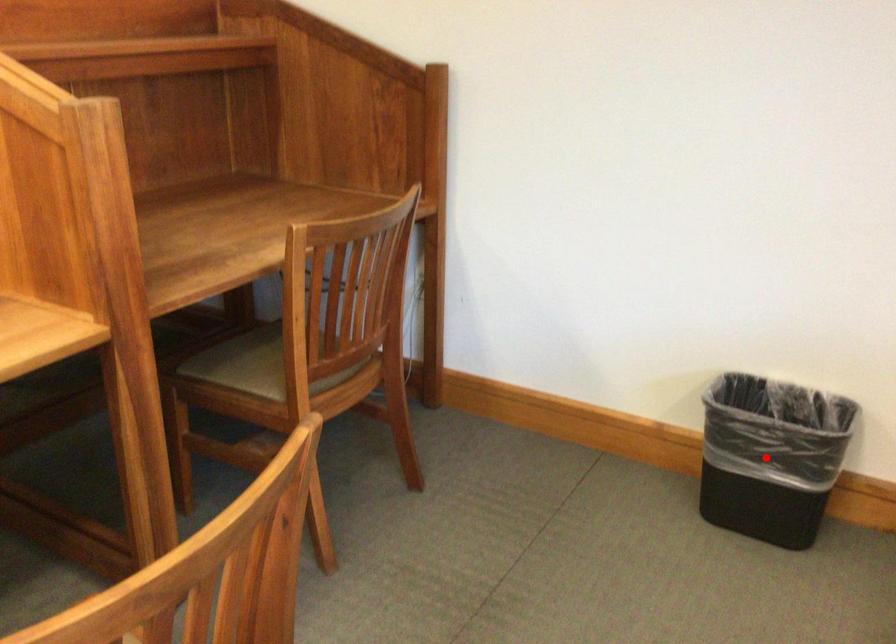
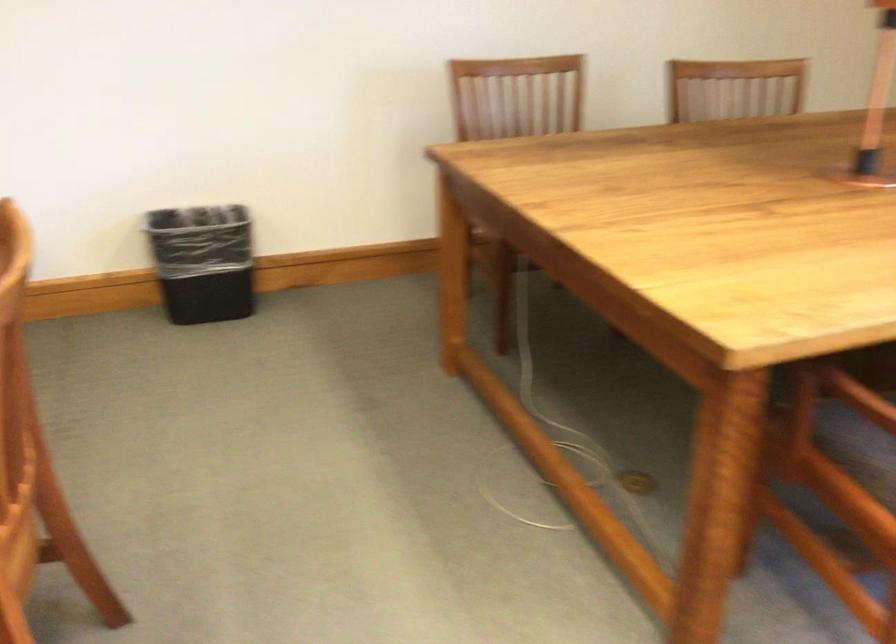
Where in the second image is the point corresponding to the highlighted location from the first image?

(202, 261)